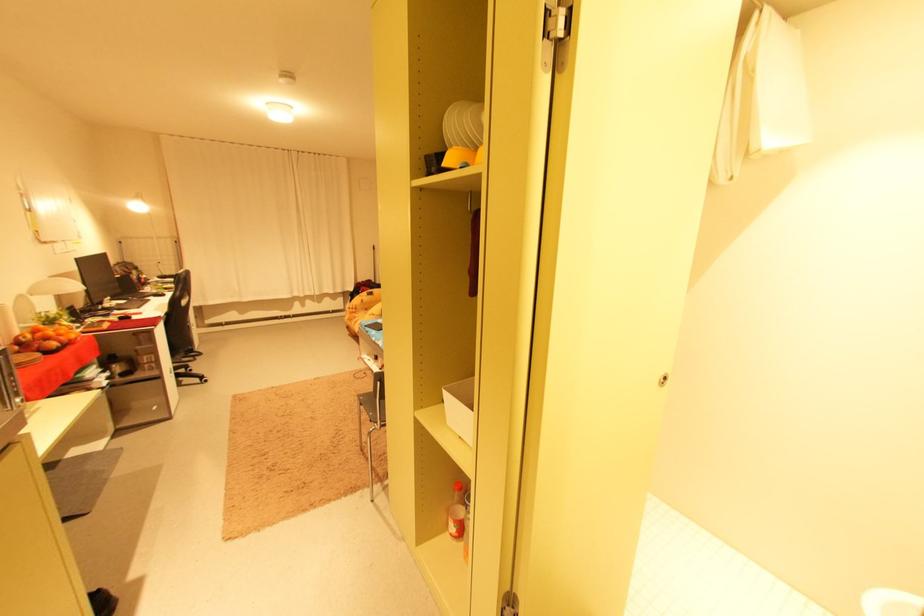
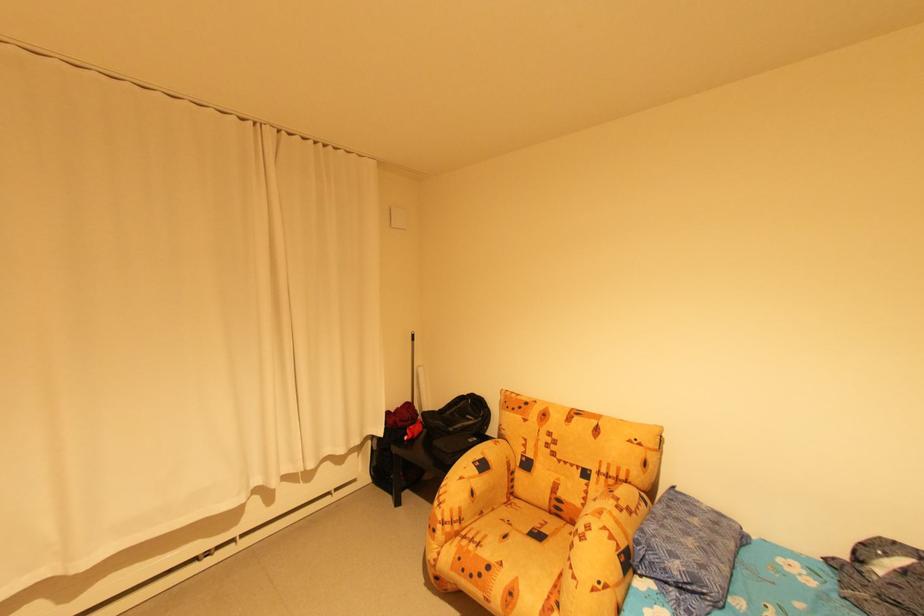
In the second image, find the point that corresponds to point (363, 314) in the first image.

(485, 545)